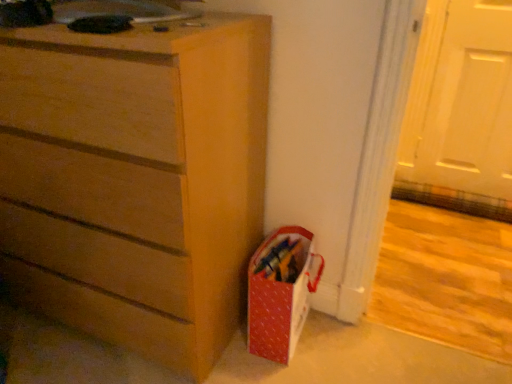
Question: Is white matte door at upper right to the left or to the right of matte wood chest of drawers at center in the image?

Choices:
 (A) right
 (B) left

Answer: (A)

Question: Which is correct: white matte door at upper right is inside matte wood chest of drawers at center, or outside of it?

Choices:
 (A) outside
 (B) inside

Answer: (A)

Question: Which of these objects is positioned closest to the matte wood chest of drawers at center?

Choices:
 (A) white matte door at upper right
 (B) matte red gift bag at lower right

Answer: (B)

Question: Which object is the closest to the matte wood chest of drawers at center?

Choices:
 (A) white matte door at upper right
 (B) matte red gift bag at lower right

Answer: (B)